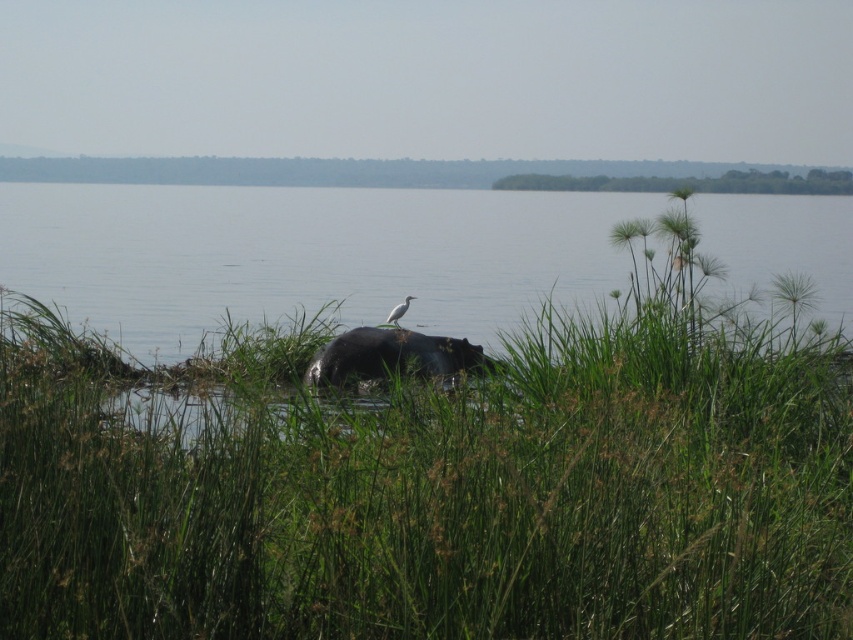
Is green leafy grass at center wider than dark brown fur hippo at center?

No, green leafy grass at center is not wider than dark brown fur hippo at center.

Does green leafy grass at center have a lesser height compared to dark brown fur hippo at center?

Correct, green leafy grass at center is not as tall as dark brown fur hippo at center.

Which is in front, point (827, 556) or point (473, 365)?

Point (827, 556) is in front.

Where is `green leafy grass at center`? The height and width of the screenshot is (640, 853). green leafy grass at center is located at coordinates (433, 492).

Who is shorter, green leafy grass at center or clear water at hippo center?

green leafy grass at center

Which is more to the left, green leafy grass at center or clear water at hippo center?

Positioned to the left is clear water at hippo center.

Is point (728, 628) positioned after point (169, 240)?

No, it is in front of (169, 240).

Identify the location of green leafy grass at center. This screenshot has width=853, height=640. (433, 492).

Does green leafy grass at center have a lesser height compared to white matte bird at center?

Correct, green leafy grass at center is not as tall as white matte bird at center.

Does green leafy grass at center have a lesser width compared to white matte bird at center?

In fact, green leafy grass at center might be wider than white matte bird at center.

This screenshot has height=640, width=853. Describe the element at coordinates (433, 492) in the screenshot. I see `green leafy grass at center` at that location.

Where is `green leafy grass at center`? The image size is (853, 640). green leafy grass at center is located at coordinates pyautogui.click(x=433, y=492).